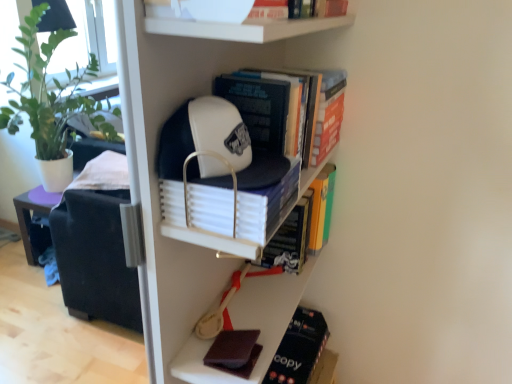
The width and height of the screenshot is (512, 384). I want to click on blank space situated above dark brown leather book at lower right, acting as the first book starting from the bottom (from a real-world perspective), so click(294, 344).